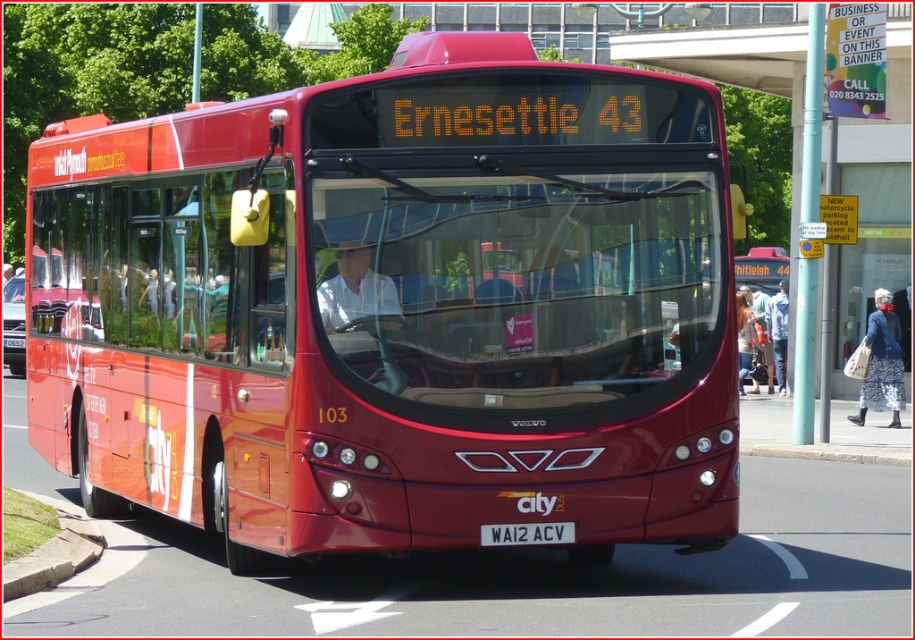
Does matte red bus at center appear over white plastic license plate at center?

Correct, matte red bus at center is located above white plastic license plate at center.

Which is below, matte red bus at center or white plastic license plate at center?

white plastic license plate at center is lower down.

This screenshot has width=915, height=640. What are the coordinates of `matte red bus at center` in the screenshot? It's located at (396, 307).

Can you confirm if matte red bus at center is taller than floral fabric dress at lower right?

Incorrect, matte red bus at center's height is not larger of floral fabric dress at lower right's.

Find the location of a particular element. This screenshot has width=915, height=640. matte red bus at center is located at coordinates (396, 307).

Is floral fabric dress at lower right to the left of white plastic license plate at center from the viewer's perspective?

Incorrect, floral fabric dress at lower right is not on the left side of white plastic license plate at center.

Between floral fabric dress at lower right and white plastic license plate at center, which one is positioned lower?

Positioned lower is white plastic license plate at center.

Who is more forward, (901, 358) or (537, 538)?

Point (537, 538) is more forward.

Where is `floral fabric dress at lower right`? floral fabric dress at lower right is located at coordinates (881, 362).